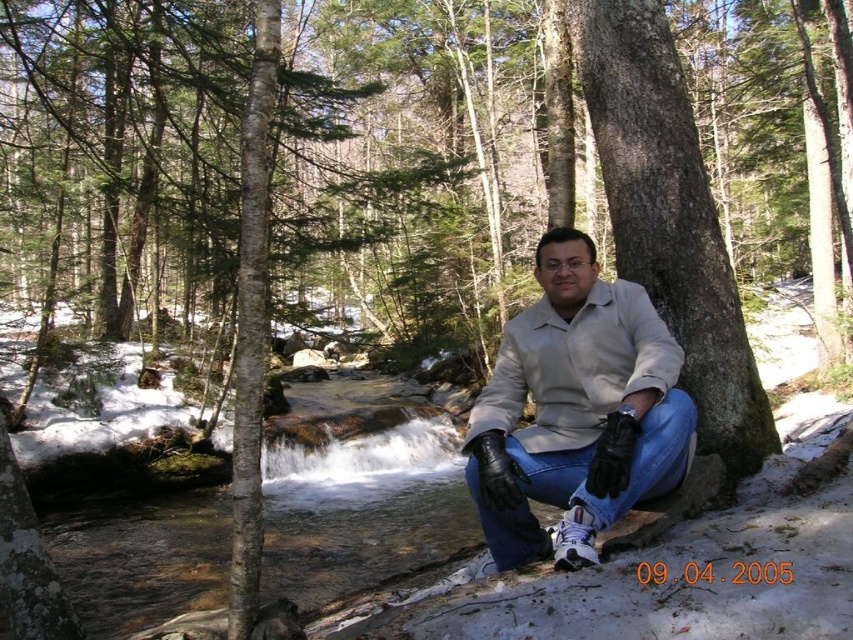
Who is shorter, beige leather jacket at center or smooth brown tree trunk at center?

With less height is beige leather jacket at center.

Is point (654, 388) positioned behind point (648, 209)?

No, it is in front of (648, 209).

Locate an element on the screen. beige leather jacket at center is located at coordinates (576, 412).

Is beige leather jacket at center to the right of smooth bark tree trunk at left from the viewer's perspective?

Yes, beige leather jacket at center is to the right of smooth bark tree trunk at left.

Measure the distance between beige leather jacket at center and camera.

beige leather jacket at center and camera are 5.97 feet apart.

Between point (549, 490) and point (244, 307), which one is positioned in front?

Positioned in front is point (244, 307).

Image resolution: width=853 pixels, height=640 pixels. In order to click on beige leather jacket at center in this screenshot , I will do `click(576, 412)`.

Who is taller, smooth brown tree trunk at center or smooth bark tree trunk at left?

With more height is smooth brown tree trunk at center.

Consider the image. Does smooth brown tree trunk at center have a greater width compared to smooth bark tree trunk at left?

Indeed, smooth brown tree trunk at center has a greater width compared to smooth bark tree trunk at left.

Which is in front, point (595, 88) or point (231, 474)?

Point (595, 88) is more forward.

Where is `smooth brown tree trunk at center`? The width and height of the screenshot is (853, 640). smooth brown tree trunk at center is located at coordinates click(x=669, y=218).